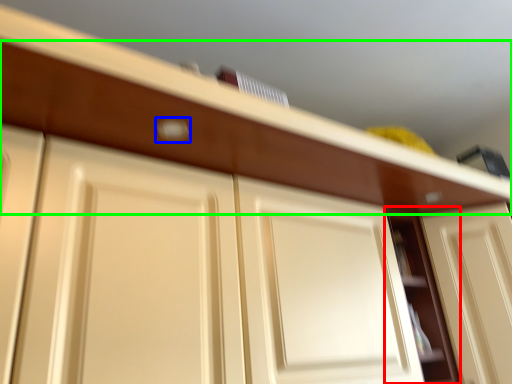
Question: Which object is the closest to the cabinet (highlighted by a red box)? Choose among these: door handle (highlighted by a blue box) or drawer (highlighted by a green box).

Choices:
 (A) door handle
 (B) drawer

Answer: (B)